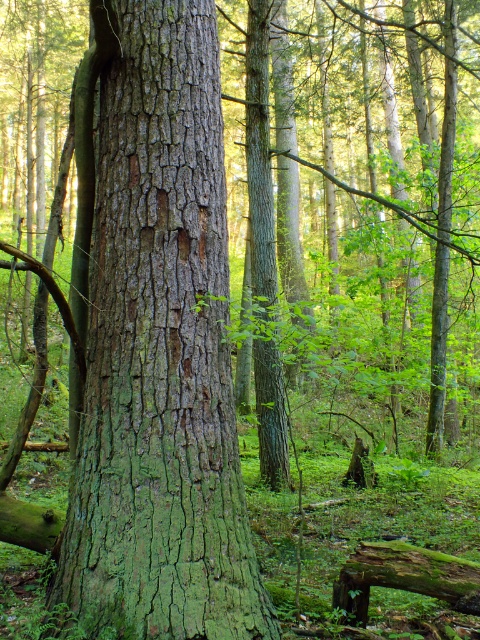
Question: Which point is farther from the camera taking this photo?

Choices:
 (A) (470, 564)
 (B) (131, 627)

Answer: (A)

Question: Can you confirm if green rough bark tree trunk at center is positioned below green mossy log at lower right?

Choices:
 (A) yes
 (B) no

Answer: (B)

Question: Can you confirm if green rough bark tree trunk at center is thinner than green mossy log at lower right?

Choices:
 (A) no
 (B) yes

Answer: (A)

Question: Can you confirm if green rough bark tree trunk at center is thinner than green mossy log at lower right?

Choices:
 (A) yes
 (B) no

Answer: (B)